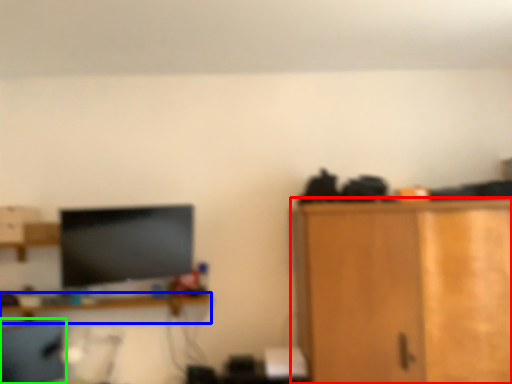
Question: Which object is positioned farthest from cabinetry (highlighted by a red box)? Select from shelf (highlighted by a blue box) and computer chair (highlighted by a green box).

Choices:
 (A) shelf
 (B) computer chair

Answer: (B)